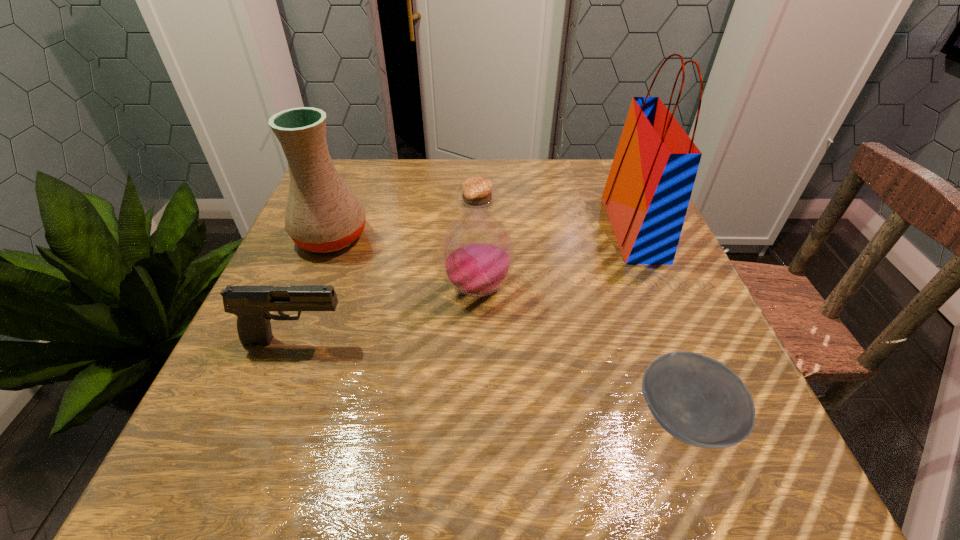
I want to click on the tallest object, so click(647, 193).

Locate an element on the screen. This screenshot has height=540, width=960. pottery is located at coordinates (322, 214).

What are the coordinates of `the third object from right to left` in the screenshot? It's located at (477, 253).

Locate an element on the screen. The image size is (960, 540). the third tallest object is located at coordinates (477, 253).

Image resolution: width=960 pixels, height=540 pixels. In order to click on the fourth tallest object in this screenshot , I will do `click(251, 304)`.

This screenshot has width=960, height=540. In order to click on the fourth farthest object in this screenshot , I will do `click(251, 304)`.

Where is `the shortest object`? The image size is (960, 540). the shortest object is located at coordinates (698, 400).

Image resolution: width=960 pixels, height=540 pixels. In order to click on the nearest object in this screenshot , I will do `click(698, 400)`.

Locate an element on the screen. This screenshot has width=960, height=540. vacant area located on the handle side of the tallest object is located at coordinates (563, 228).

What are the coordinates of `vacant space located on the handle side of the tallest object` in the screenshot? It's located at (588, 228).